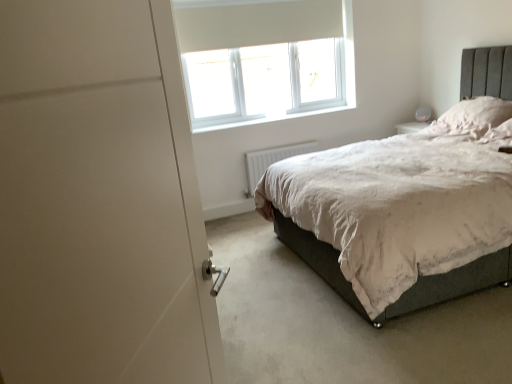
What are the coordinates of `white plastic radiator at lower center` in the screenshot? It's located at (271, 160).

The height and width of the screenshot is (384, 512). I want to click on white fluffy pillow at upper right, so click(x=473, y=116).

This screenshot has width=512, height=384. Find the location of `white plastic radiator at lower center`. white plastic radiator at lower center is located at coordinates (271, 160).

Which object is closer to the camera taking this photo, white plastic window at upper center or white fluffy pillow at upper right?

Positioned in front is white fluffy pillow at upper right.

Identify the location of window on the left of white fluffy pillow at upper right. The width and height of the screenshot is (512, 384). (264, 59).

Between white plastic window at upper center and white fluffy pillow at upper right, which one has smaller width?

Thinner between the two is white plastic window at upper center.

From the image's perspective, which one is positioned higher, white plastic window at upper center or white fluffy pillow at upper right?

white plastic window at upper center is shown above in the image.

Is white matte door at left touching white plastic window at upper center?

white matte door at left and white plastic window at upper center are clearly separated.

Could you tell me if white matte door at left is facing white plastic window at upper center?

No, white matte door at left is not aimed at white plastic window at upper center.

Which point is more forward, (170, 51) or (288, 51)?

The point (170, 51) is more forward.

Considering the sizes of white matte door at left and white plastic radiator at lower center in the image, is white matte door at left wider or thinner than white plastic radiator at lower center?

In the image, white matte door at left appears to be wider than white plastic radiator at lower center.

From the image's perspective, would you say white matte door at left is shown under white plastic radiator at lower center?

Correct, white matte door at left appears lower than white plastic radiator at lower center in the image.

From a real-world perspective, is white matte door at left positioned above or below white plastic radiator at lower center?

white matte door at left is situated higher than white plastic radiator at lower center in the real world.

Is white matte door at left oriented away from white plastic radiator at lower center?

white matte door at left is not turned away from white plastic radiator at lower center.

Is white fluffy pillow at upper right far from white matte door at left?

white fluffy pillow at upper right is positioned a significant distance from white matte door at left.

From a real-world perspective, is white fluffy pillow at upper right above or below white matte door at left?

white fluffy pillow at upper right is situated lower than white matte door at left in the real world.

Which object is wider, white fluffy pillow at upper right or white matte door at left?

With larger width is white fluffy pillow at upper right.

Considering the sizes of objects white matte door at left and white fluffy pillow at upper right in the image provided, who is wider, white matte door at left or white fluffy pillow at upper right?

white fluffy pillow at upper right.

Which object is further away from the camera, white matte door at left or white fluffy pillow at upper right?

white fluffy pillow at upper right is further away from the camera.

Which of these two, white matte door at left or white fluffy pillow at upper right, is bigger?

Bigger between the two is white matte door at left.

Can you confirm if white matte door at left is positioned to the left of white fluffy pillow at upper right?

Yes.

Considering the positions of objects white fluffy pillow at upper right and white plastic window at upper center in the image provided, who is more to the left, white fluffy pillow at upper right or white plastic window at upper center?

Positioned to the left is white plastic window at upper center.

Considering the sizes of objects white fluffy pillow at upper right and white plastic window at upper center in the image provided, who is wider, white fluffy pillow at upper right or white plastic window at upper center?

white fluffy pillow at upper right is wider.

Considering the sizes of objects white fluffy pillow at upper right and white plastic window at upper center in the image provided, who is shorter, white fluffy pillow at upper right or white plastic window at upper center?

white fluffy pillow at upper right is shorter.

Is the surface of white fluffy pillow at upper right in direct contact with white plastic window at upper center?

They are not placed beside each other.

Based on their positions, is white plastic window at upper center located to the left or right of white matte door at left?

white plastic window at upper center is positioned on white matte door at left's right side.

Image resolution: width=512 pixels, height=384 pixels. I want to click on window above the white matte door at left (from the image's perspective), so click(264, 59).

From the image's perspective, is white plastic window at upper center under white matte door at left?

No.

From their relative heights in the image, would you say white plastic window at upper center is taller or shorter than white matte door at left?

In the image, white plastic window at upper center appears to be shorter than white matte door at left.

The image size is (512, 384). What are the coordinates of `window lying on the left of white fluffy pillow at upper right` in the screenshot? It's located at (264, 59).

At what (x,y) coordinates should I click in order to perform the action: click on screen door in front of the white plastic window at upper center. Please return your answer as a coordinate pair (x, y). Looking at the image, I should click on (99, 200).

From the image, which object appears to be farther from white matte door at left, white plastic window at upper center or white plastic radiator at lower center?

white plastic window at upper center is positioned further to the anchor white matte door at left.

From the image, which object appears to be farther from white matte door at left, white plastic window at upper center or white fluffy pillow at upper right?

The object further to white matte door at left is white plastic window at upper center.

Based on the photo, based on their spatial positions, is white matte door at left or white plastic radiator at lower center closer to white plastic window at upper center?

Among the two, white plastic radiator at lower center is located nearer to white plastic window at upper center.

Looking at the image, which one is located further to white matte door at left, white fluffy pillow at upper right or white plastic radiator at lower center?

Among the two, white plastic radiator at lower center is located further to white matte door at left.

Considering their positions, is white matte door at left positioned closer to white plastic window at upper center than white fluffy pillow at upper right?

white fluffy pillow at upper right.

From the image, which object appears to be farther from white fluffy pillow at upper right, white matte door at left or white plastic radiator at lower center?

white matte door at left.

Which object lies further to the anchor point white plastic radiator at lower center, white matte door at left or white plastic window at upper center?

white matte door at left is positioned further to the anchor white plastic radiator at lower center.

Which object lies further to the anchor point white fluffy pillow at upper right, white plastic radiator at lower center or white plastic window at upper center?

white plastic window at upper center is further to white fluffy pillow at upper right.

In order to click on window between white matte door at left and white plastic radiator at lower center from front to back in this screenshot , I will do `click(264, 59)`.

You are a GUI agent. You are given a task and a screenshot of the screen. Output one action in this format:
    pyautogui.click(x=<x>, y=<y>)
    Task: Click on the pillow positioned between white matte door at left and white plastic radiator at lower center from near to far
    This screenshot has height=384, width=512.
    Given the screenshot: What is the action you would take?
    pyautogui.click(x=473, y=116)

The height and width of the screenshot is (384, 512). Identify the location of pillow between white matte door at left and white plastic window at upper center in the front-back direction. (473, 116).

Where is `radiator between white plastic window at upper center and white fluffy pillow at upper right in the horizontal direction`? radiator between white plastic window at upper center and white fluffy pillow at upper right in the horizontal direction is located at coordinates (271, 160).